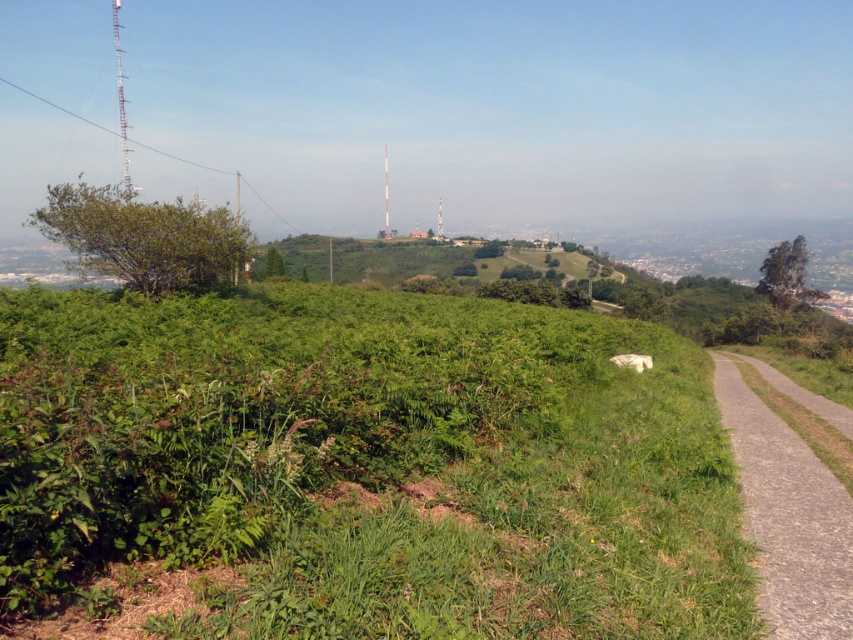
Question: Can you confirm if green leafy grass at center is wider than gray gravel path at right?

Choices:
 (A) yes
 (B) no

Answer: (A)

Question: From the image, what is the correct spatial relationship of green leafy grass at center in relation to gray gravel path at right?

Choices:
 (A) above
 (B) below

Answer: (A)

Question: Does green leafy grass at center have a greater width compared to gray gravel path at right?

Choices:
 (A) yes
 (B) no

Answer: (A)

Question: Among these points, which one is nearest to the camera?

Choices:
 (A) (809, 580)
 (B) (477, 426)

Answer: (A)